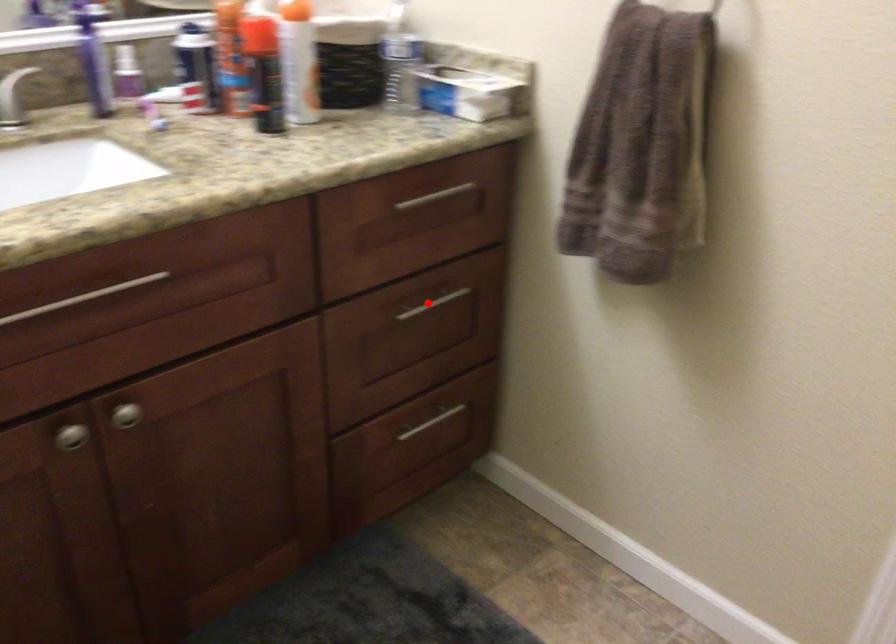
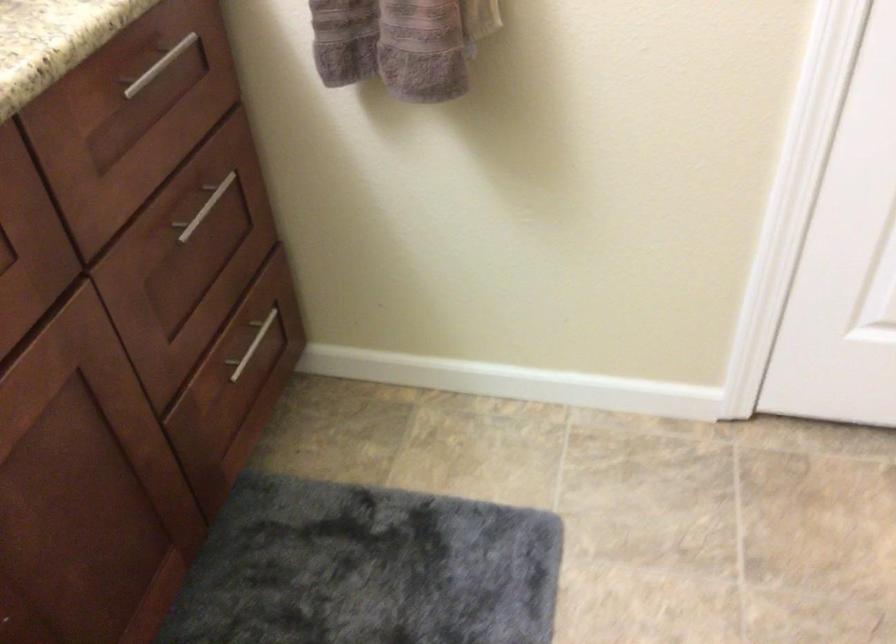
Locate, in the second image, the point that corresponds to the highlighted location in the first image.

(203, 207)